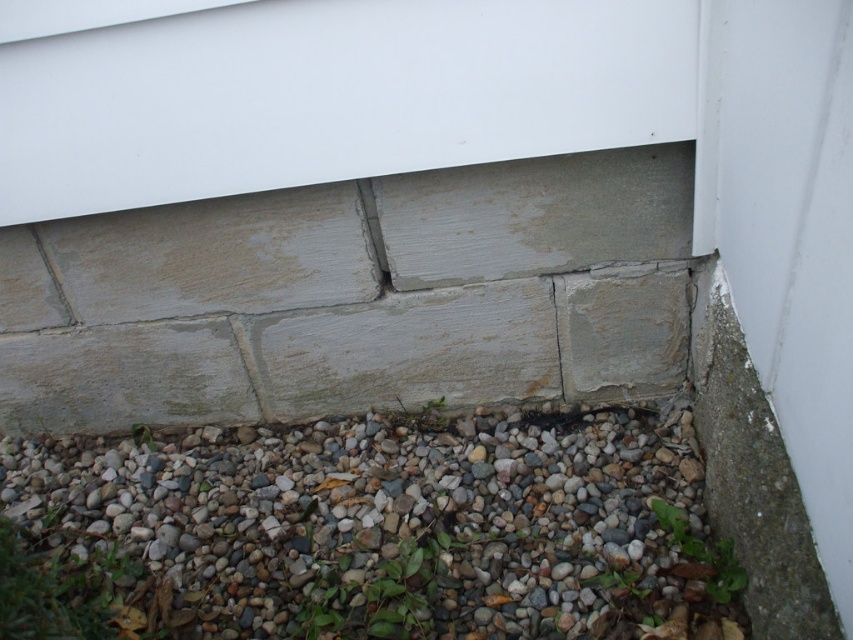
Question: Observing the image, what is the correct spatial positioning of gray gravel at lower center in reference to gray concrete crack at lower left?

Choices:
 (A) above
 (B) below

Answer: (B)

Question: Observing the image, what is the correct spatial positioning of gray gravel at lower center in reference to gray concrete crack at lower left?

Choices:
 (A) right
 (B) left

Answer: (A)

Question: Can you confirm if gray gravel at lower center is positioned below gray concrete crack at lower left?

Choices:
 (A) no
 (B) yes

Answer: (B)